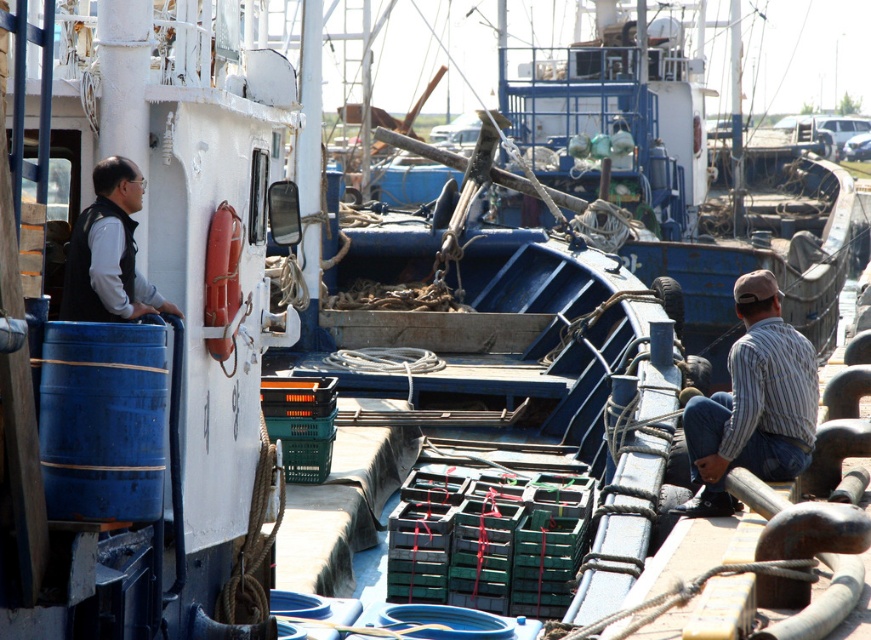
Question: Is striped cotton shirt at lower right closer to camera compared to black matte vest at left?

Choices:
 (A) yes
 (B) no

Answer: (B)

Question: Which of the following is the closest to the observer?

Choices:
 (A) blue painted wood boat at center
 (B) striped cotton shirt at lower right
 (C) black matte vest at left

Answer: (C)

Question: Estimate the real-world distances between objects in this image. Which object is farther from the blue painted wood boat at center?

Choices:
 (A) striped cotton shirt at lower right
 (B) black matte vest at left

Answer: (A)

Question: Is striped cotton shirt at lower right to the left of black matte vest at left from the viewer's perspective?

Choices:
 (A) no
 (B) yes

Answer: (A)

Question: Does striped cotton shirt at lower right appear over black matte vest at left?

Choices:
 (A) yes
 (B) no

Answer: (B)

Question: Which of the following is the closest to the observer?

Choices:
 (A) black matte vest at left
 (B) blue painted wood boat at center
 (C) striped cotton shirt at lower right

Answer: (A)